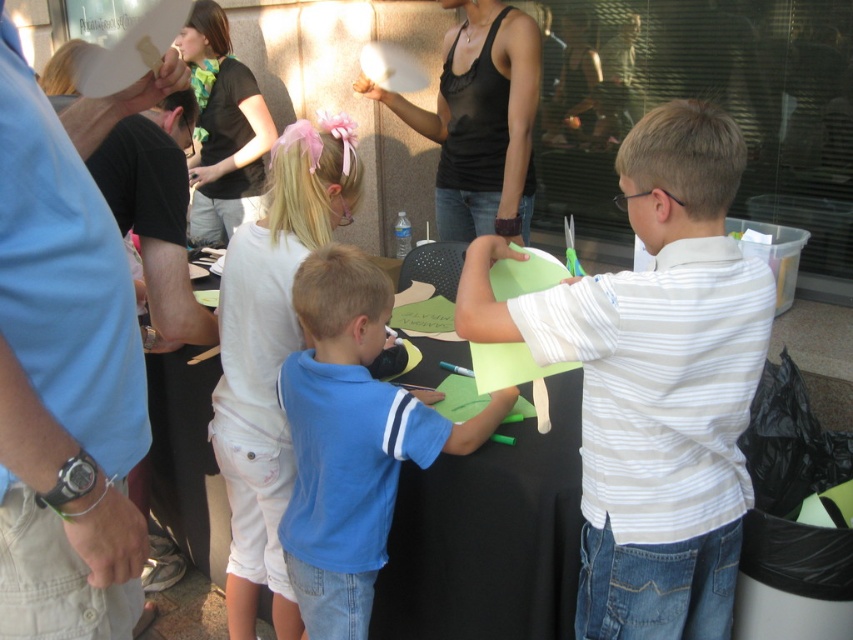
Between blue cotton shirt at center and black tank top at upper center, which one appears on the left side from the viewer's perspective?

blue cotton shirt at center is more to the left.

Is blue cotton shirt at center above black tank top at upper center?

No.

At what (x,y) coordinates should I click in order to perform the action: click on blue cotton shirt at center. Please return your answer as a coordinate pair (x, y). This screenshot has height=640, width=853. Looking at the image, I should click on (351, 440).

Find the location of a particular element. Image resolution: width=853 pixels, height=640 pixels. blue cotton shirt at center is located at coordinates (351, 440).

Does white striped shirt at center have a lesser height compared to black tank top at upper center?

In fact, white striped shirt at center may be taller than black tank top at upper center.

Can you confirm if white striped shirt at center is thinner than black tank top at upper center?

Correct, white striped shirt at center's width is less than black tank top at upper center's.

Which is behind, point (677, 156) or point (520, 17)?

The point (520, 17) is more distant.

Image resolution: width=853 pixels, height=640 pixels. Find the location of `white striped shirt at center`. white striped shirt at center is located at coordinates (654, 381).

The height and width of the screenshot is (640, 853). What do you see at coordinates (65, 371) in the screenshot?
I see `blue shirt at upper left` at bounding box center [65, 371].

Find the location of a particular element. The width and height of the screenshot is (853, 640). blue shirt at upper left is located at coordinates (65, 371).